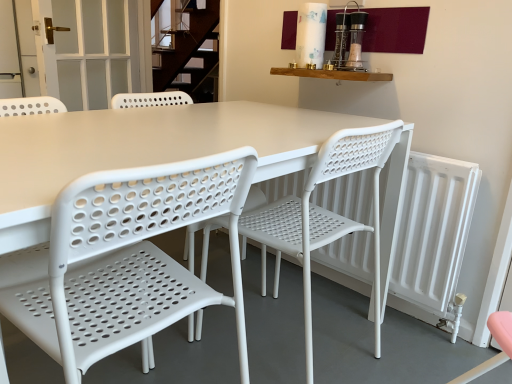
Locate an element on the screen. vacant space underneath white plastic chair at center, the 2th chair from the left (from a real-world perspective) is located at coordinates (291, 344).